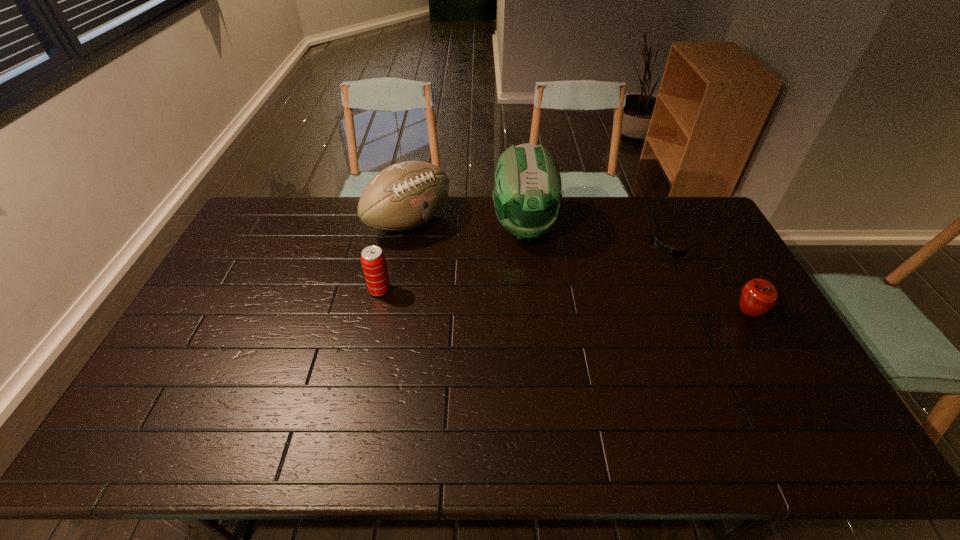
Find the location of a particular element. This screenshot has height=540, width=960. vacant spot on the desktop that is between the soda can and the apple and is positioned on the visor of the tallest object is located at coordinates (538, 300).

Locate an element on the screen. Image resolution: width=960 pixels, height=540 pixels. vacant space on the desktop that is between the soda can and the fourth tallest object and is positioned on the front-facing side of the sunglasses is located at coordinates (593, 303).

You are a GUI agent. You are given a task and a screenshot of the screen. Output one action in this format:
    pyautogui.click(x=<x>, y=<y>)
    Task: Click on the free space on the desktop that is between the second nearest object and the apple and is positioned on the laces of the football (American)
    Image resolution: width=960 pixels, height=540 pixels.
    Given the screenshot: What is the action you would take?
    pyautogui.click(x=522, y=299)